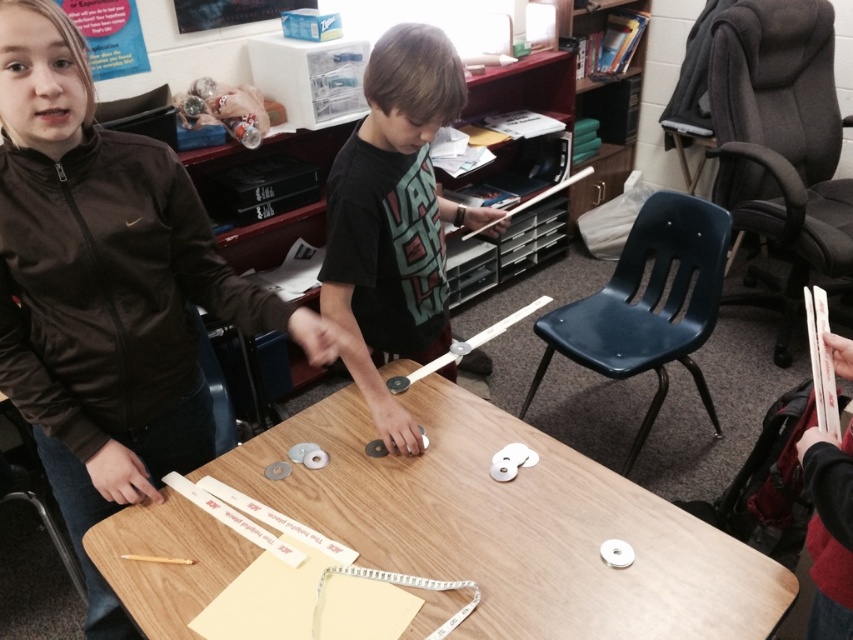
Is black matte shirt at center above matte black chair at lower left?

Indeed, black matte shirt at center is positioned over matte black chair at lower left.

Is point (370, 275) behind point (28, 488)?

No, (370, 275) is in front of (28, 488).

Does point (364, 221) lie behind point (25, 428)?

No, it is not.

This screenshot has width=853, height=640. What are the coordinates of `black matte shirt at center` in the screenshot? It's located at (395, 218).

In the scene shown: Can you confirm if dark gray fabric office chair at right is taller than matte black chair at lower left?

Yes.

Which is in front, point (733, 54) or point (16, 467)?

Positioned in front is point (16, 467).

I want to click on dark gray fabric office chair at right, so point(780,145).

Can you confirm if blue plastic chair at right is positioned to the right of matte black chair at lower left?

Yes, blue plastic chair at right is to the right of matte black chair at lower left.

Which is behind, point (701, 323) or point (71, 572)?

The point (701, 323) is more distant.

The width and height of the screenshot is (853, 640). Describe the element at coordinates (647, 305) in the screenshot. I see `blue plastic chair at right` at that location.

Where is `blue plastic chair at right`? This screenshot has height=640, width=853. blue plastic chair at right is located at coordinates (647, 305).